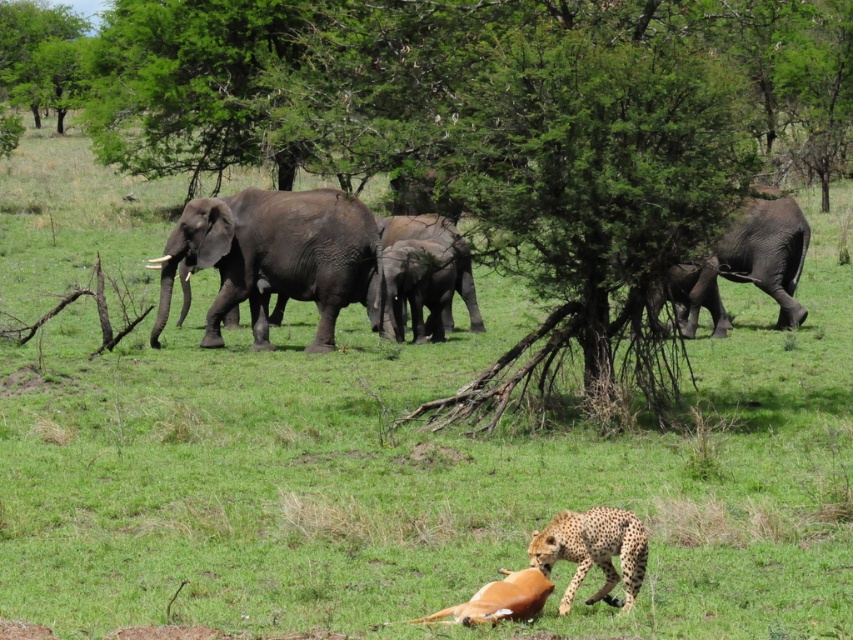
Is gray textured elephant at right positioned behind gray matte elephant at center?

Yes.

Is gray textured elephant at right taller than gray matte elephant at center?

No, gray textured elephant at right is not taller than gray matte elephant at center.

Locate an element on the screen. gray textured elephant at right is located at coordinates (746, 262).

Is gray textured elephant at left smaller than spotted fur cheetah at lower center?

No.

Image resolution: width=853 pixels, height=640 pixels. What do you see at coordinates (276, 257) in the screenshot?
I see `gray textured elephant at left` at bounding box center [276, 257].

The height and width of the screenshot is (640, 853). What do you see at coordinates (276, 257) in the screenshot?
I see `gray textured elephant at left` at bounding box center [276, 257].

The width and height of the screenshot is (853, 640). Find the location of `gray textured elephant at left`. gray textured elephant at left is located at coordinates (276, 257).

Does point (308, 349) lie behind point (775, 209)?

No.

Does gray textured elephant at left have a larger size compared to gray textured elephant at right?

Indeed, gray textured elephant at left has a larger size compared to gray textured elephant at right.

Which is behind, point (329, 305) or point (746, 268)?

Positioned behind is point (746, 268).

Locate an element on the screen. The width and height of the screenshot is (853, 640). gray textured elephant at left is located at coordinates (276, 257).